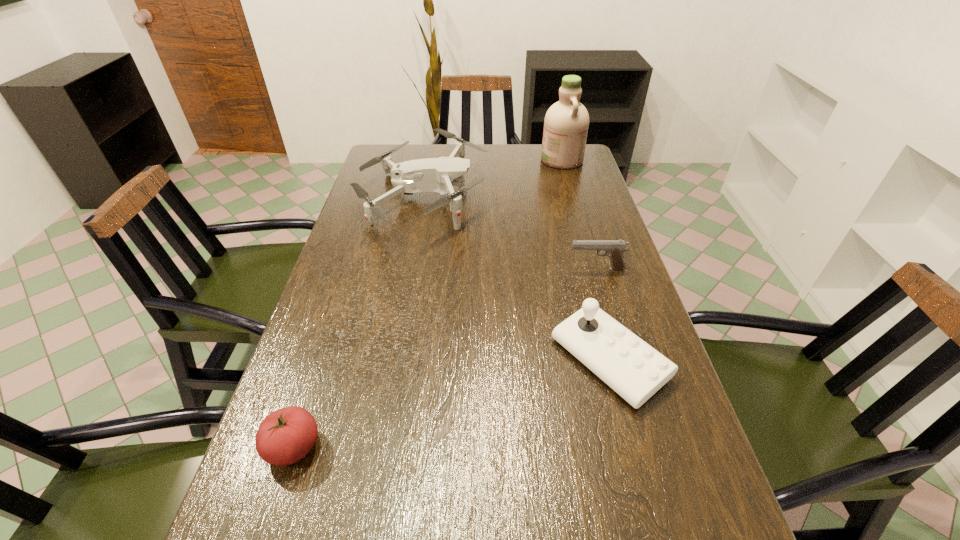
The width and height of the screenshot is (960, 540). In order to click on vacant point located on the back of the fifth farthest object in this screenshot , I will do `click(327, 344)`.

Locate an element on the screen. The image size is (960, 540). free point located at the barrel of the pistol is located at coordinates (539, 269).

Find the location of `free region located at the barrel of the pistol`. free region located at the barrel of the pistol is located at coordinates (475, 269).

This screenshot has height=540, width=960. I want to click on vacant space positioned at the barrel of the pistol, so click(457, 269).

Where is `cleansing agent that is positioned at the far edge`? cleansing agent that is positioned at the far edge is located at coordinates (566, 123).

The width and height of the screenshot is (960, 540). What are the coordinates of `drone present at the far edge` in the screenshot? It's located at click(x=432, y=174).

You are a GUI agent. You are given a task and a screenshot of the screen. Output one action in this format:
    pyautogui.click(x=<x>, y=<y>)
    Task: Click on the drone positioned at the left edge
    Image resolution: width=960 pixels, height=540 pixels.
    Given the screenshot: What is the action you would take?
    pyautogui.click(x=432, y=174)

In order to click on tomato located in the left edge section of the desktop in this screenshot , I will do `click(285, 436)`.

Locate an element on the screen. The height and width of the screenshot is (540, 960). cleansing agent located in the right edge section of the desktop is located at coordinates (566, 123).

Find the location of a particular element. joystick that is positioned at the right edge is located at coordinates (632, 368).